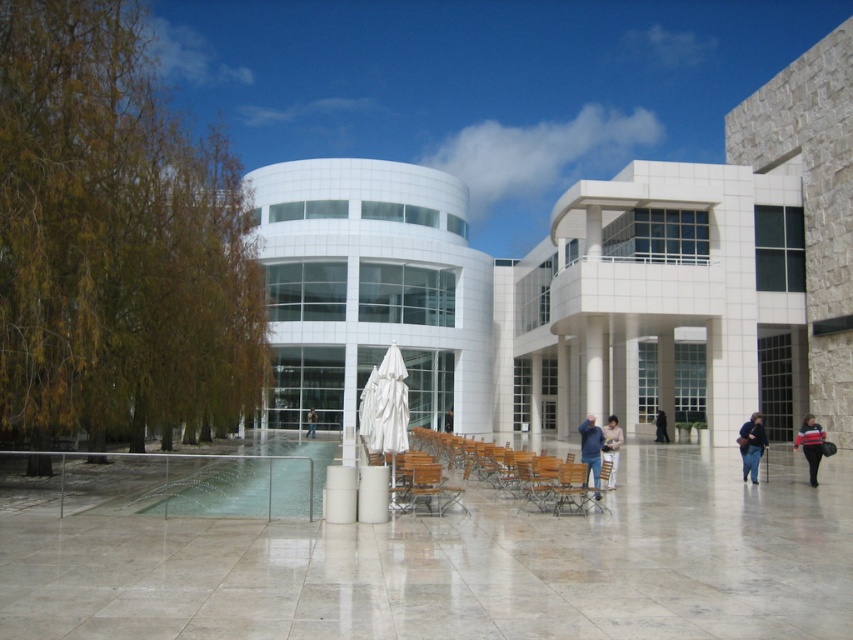
Based on the photo, you are standing at the entrance of the modern architectural structure and want to reach the point marked as point (363, 424). If you walk straight ahead, will you reach that point before walking 100 feet?

The distance between you and point (363, 424) is 86.56 feet, so yes, you will reach the point before walking 100 feet.

You are standing in front of the modern architectural structure and want to take a photo. There are two points marked in the scene, point 1 at coordinates point (370, 401) and point 2 at coordinates point (747, 458). Which point is closer to your camera position?

Point (370, 401) is further to the camera than point (747, 458), so the point closer to the camera is point (747, 458).

You are standing in front of the museum and notice a white fabric umbrella at center and a light beige fabric jacket at center. Which object is positioned higher in the scene?

The white fabric umbrella at center is located above the light beige fabric jacket at center, so it is positioned higher.